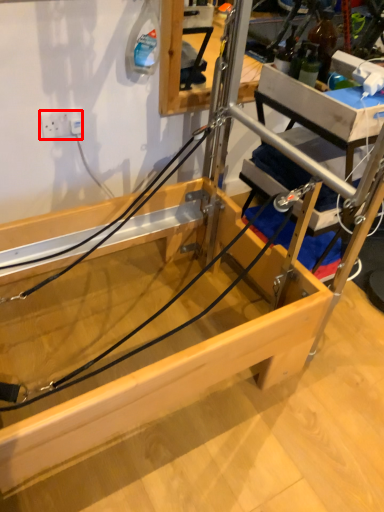
Question: From the image's perspective, what is the correct spatial positioning of electric outlet (annotated by the red box) in reference to string?

Choices:
 (A) above
 (B) below

Answer: (A)